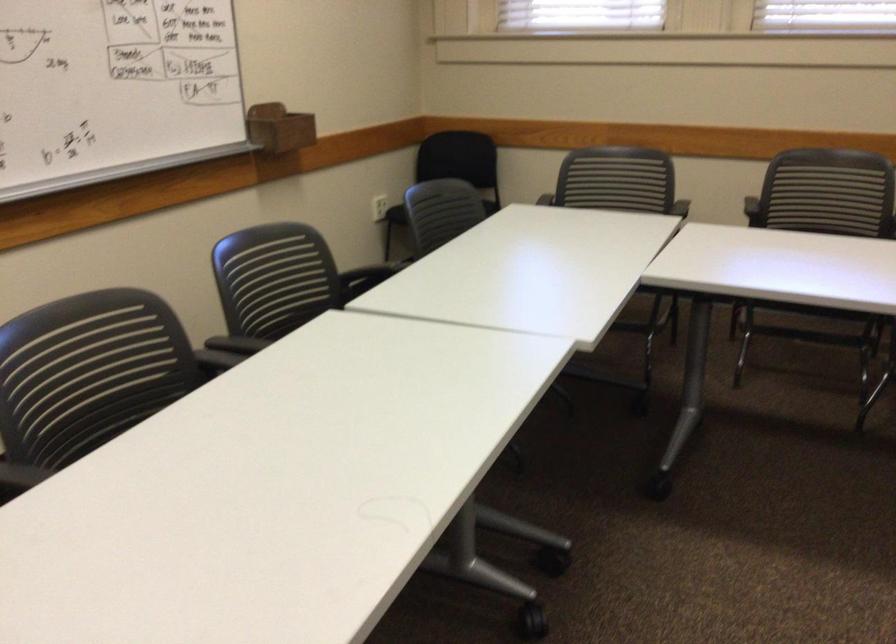
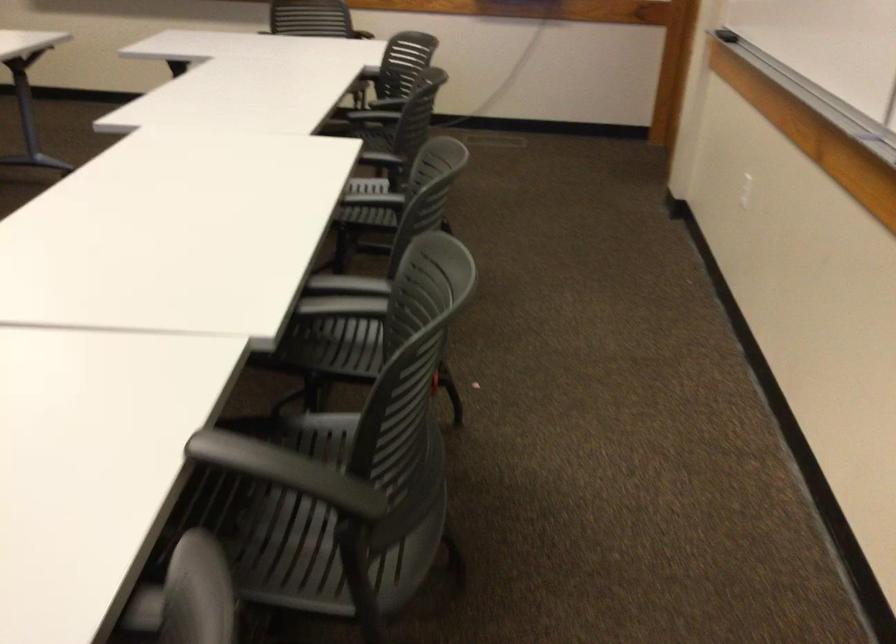
Where in the second image is the point corresponding to (x=214, y=361) from the first image?

(343, 297)